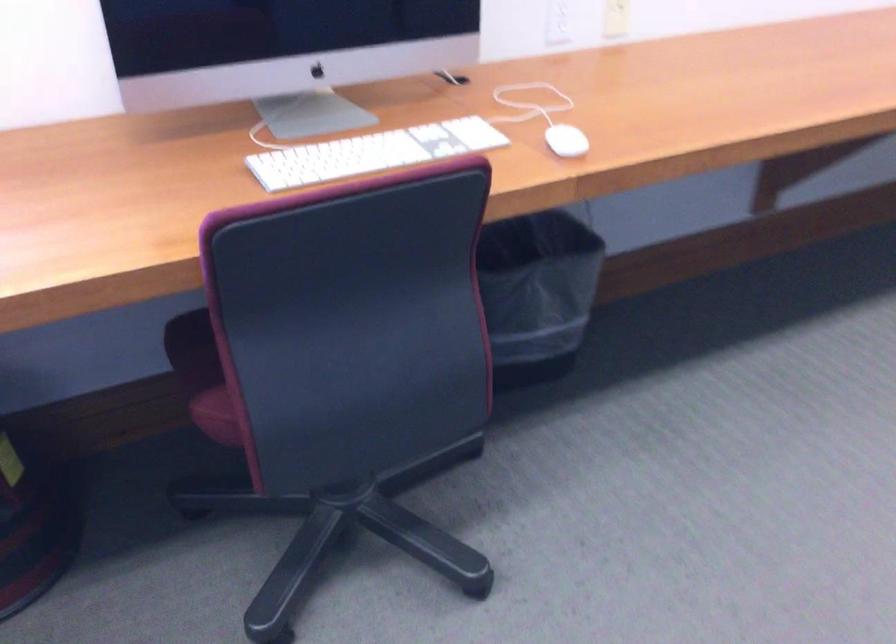
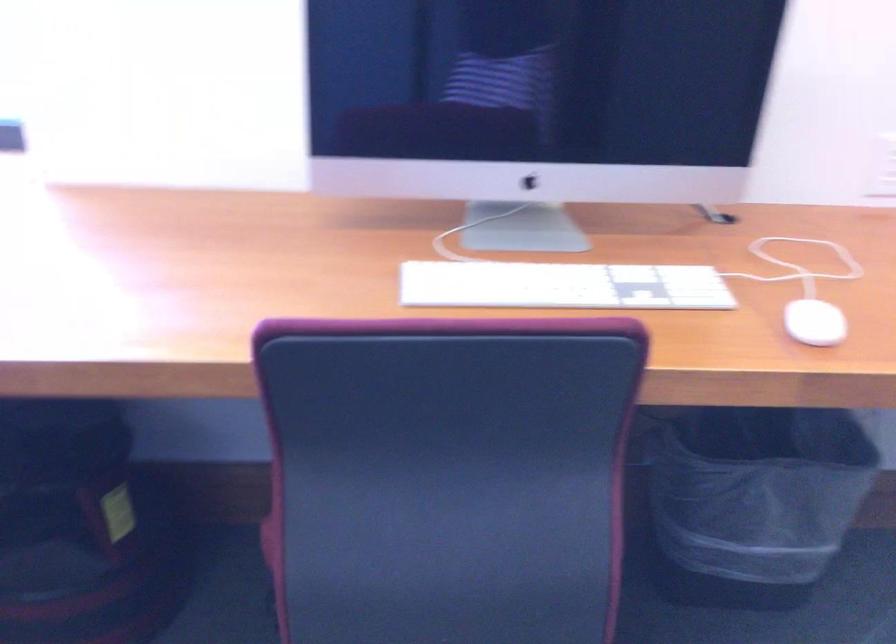
The point at (385, 151) is marked in the first image. Where is the corresponding point in the second image?

(562, 285)